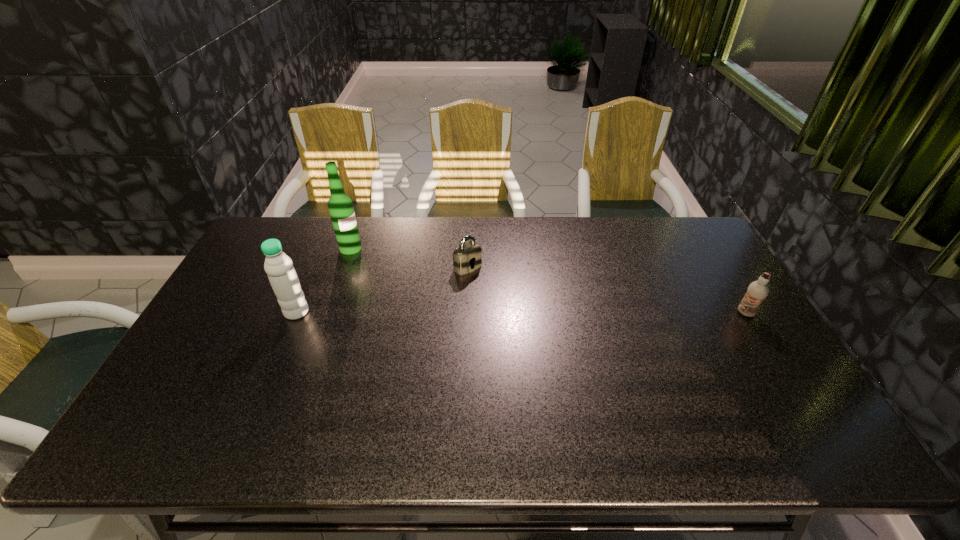
What are the coordinates of `the third shortest object` in the screenshot? It's located at (283, 278).

At what (x,y) coordinates should I click in order to perform the action: click on water bottle. Please return your answer as a coordinate pair (x, y). The width and height of the screenshot is (960, 540). Looking at the image, I should click on (283, 278).

Where is `the second shortest object`? the second shortest object is located at coordinates (757, 291).

Locate an element on the screen. the rightmost object is located at coordinates (757, 291).

What are the coordinates of `the farthest object` in the screenshot? It's located at (340, 206).

Locate an element on the screen. beer bottle is located at coordinates (340, 206).

The image size is (960, 540). What are the coordinates of `the third object from left to right` in the screenshot? It's located at (467, 257).

You are a GUI agent. You are given a task and a screenshot of the screen. Output one action in this format:
    pyautogui.click(x=<x>, y=<y>)
    Task: Click on the padlock
    
    Given the screenshot: What is the action you would take?
    pyautogui.click(x=467, y=257)

In order to click on blank area located on the left of the third shortest object in this screenshot , I will do `click(209, 312)`.

You are a GUI agent. You are given a task and a screenshot of the screen. Output one action in this format:
    pyautogui.click(x=<x>, y=<y>)
    Task: Click on the vacant space situated 0.070m on the left of the third tallest object
    Image resolution: width=960 pixels, height=540 pixels.
    Given the screenshot: What is the action you would take?
    pyautogui.click(x=712, y=313)